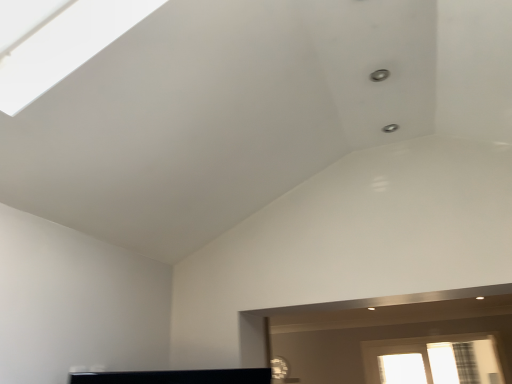
Question: Should I look upward or downward to see translucent glass window at lower right?

Choices:
 (A) up
 (B) down

Answer: (B)